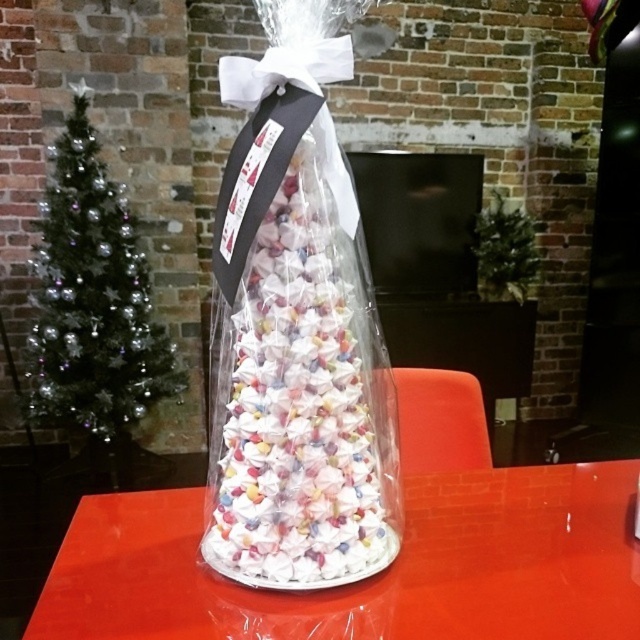
Can you confirm if translucent plastic table at center is shorter than translucent paper cone at center?

Indeed, translucent plastic table at center has a lesser height compared to translucent paper cone at center.

Is translucent plastic table at center wider than translucent paper cone at center?

Yes.

Identify the location of translucent plastic table at center. (374, 576).

Find the location of a particular element. The height and width of the screenshot is (640, 640). translucent plastic table at center is located at coordinates (374, 576).